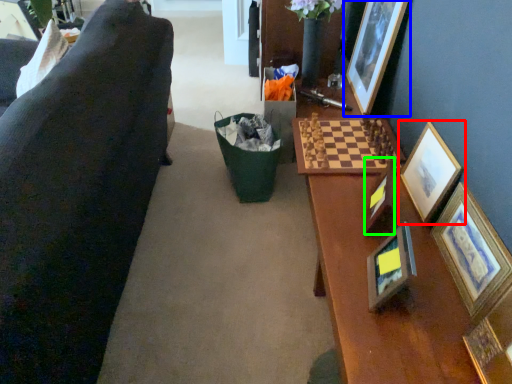
Question: Considering the real-world distances, which object is farthest from picture frame (highlighted by a red box)? picture frame (highlighted by a blue box) or picture frame (highlighted by a green box)?

Choices:
 (A) picture frame
 (B) picture frame

Answer: (A)